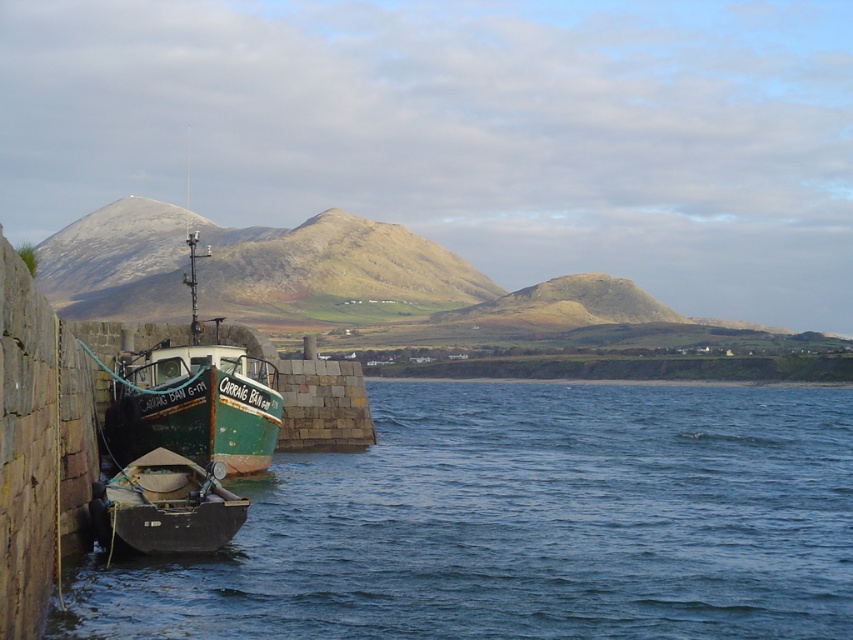
Question: Can you confirm if blue water at lower left is smaller than green matte boat at lower left?

Choices:
 (A) yes
 (B) no

Answer: (B)

Question: Does blue water at lower left appear over green matte boat at lower left?

Choices:
 (A) yes
 (B) no

Answer: (B)

Question: Which of the following is the closest to the observer?

Choices:
 (A) blue water at lower left
 (B) green matte boat at lower left

Answer: (A)

Question: Which point is closer to the camera?

Choices:
 (A) (340, 580)
 (B) (135, 545)

Answer: (A)

Question: Is blue water at lower left below green matte boat at lower left?

Choices:
 (A) no
 (B) yes

Answer: (B)